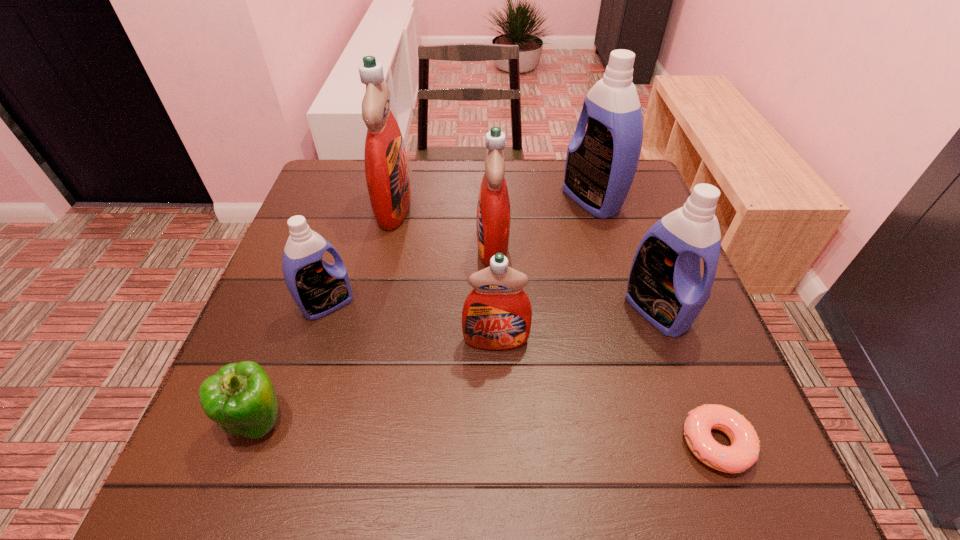
Where is `bell pepper that is at the near edge`? The image size is (960, 540). bell pepper that is at the near edge is located at coordinates (240, 397).

This screenshot has height=540, width=960. Identify the location of doughnut present at the near edge. (744, 451).

Where is `detergent that is at the left edge`? detergent that is at the left edge is located at coordinates (318, 288).

At what (x,y) coordinates should I click in order to perform the action: click on bell pepper that is at the left edge. Please return your answer as a coordinate pair (x, y). Looking at the image, I should click on (240, 397).

Find the location of a particular element. The image size is (960, 540). doughnut that is at the right edge is located at coordinates (744, 451).

At what (x,y) coordinates should I click in order to perform the action: click on object at the near left corner. Please return your answer as a coordinate pair (x, y). Image resolution: width=960 pixels, height=540 pixels. Looking at the image, I should click on (240, 397).

Locate an element on the screen. This screenshot has height=540, width=960. object situated at the far right corner is located at coordinates (601, 163).

This screenshot has height=540, width=960. Identify the location of object located at the near right corner. [744, 451].

Where is `free location at the far edge of the desktop`? free location at the far edge of the desktop is located at coordinates (428, 203).

Where is `vacant space at the near edge of the desktop`? vacant space at the near edge of the desktop is located at coordinates (488, 467).